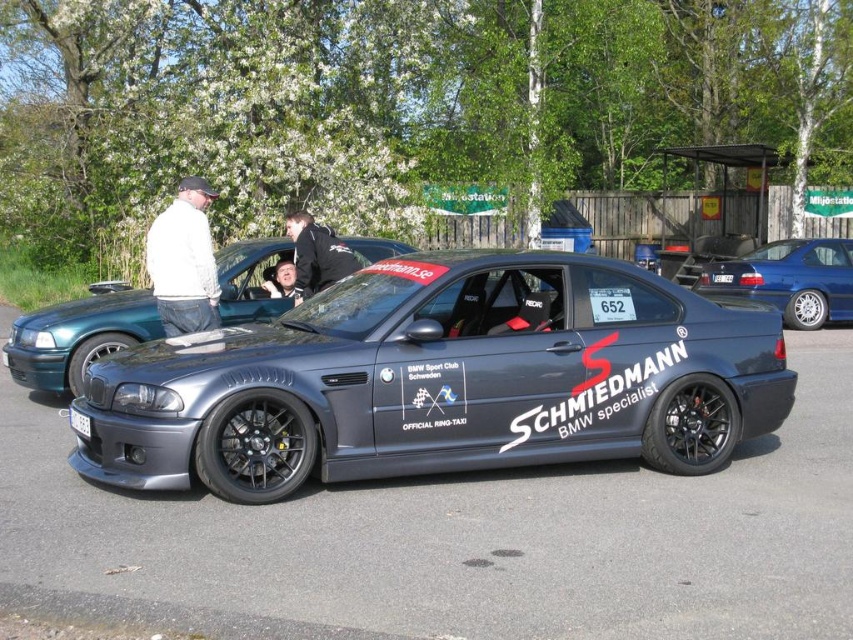
You are a photographer at the motorsport event and want to take a photo of the white cotton jacket at upper left and the satin black car at center. Based on their positions, which object is closer to the left edge of the photo?

The satin black car at center is to the left of white cotton jacket at upper left, so the satin black car at center is closer to the left edge of the photo.

You are a photographer at the event and need to capture a photo of the satin black car at center without any people in the frame. Given that the white cotton jacket at upper left is closer to the camera than the car, can you position yourself so that the jacket is hidden behind the car?

The satin black car at center is larger in size than the white cotton jacket at upper left. Since the jacket is closer to the camera, you can position yourself so that the car obscures the jacket by moving to a position where the larger car blocks the view of the jacket.